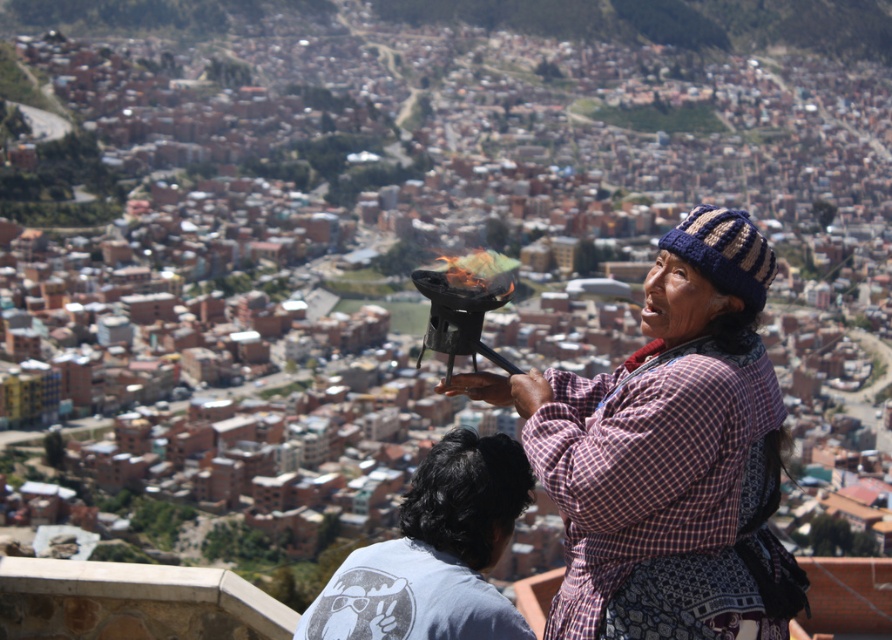
Question: Among these objects, which one is nearest to the camera?

Choices:
 (A) gray cotton shirt at lower left
 (B) light blue cotton t-shirt at lower center

Answer: (B)

Question: Where is plaid fabric shawl at center located in relation to light blue cotton t-shirt at lower center in the image?

Choices:
 (A) below
 (B) above

Answer: (B)

Question: Can you confirm if plaid fabric shawl at center is bigger than gray cotton shirt at lower left?

Choices:
 (A) yes
 (B) no

Answer: (A)

Question: Among these points, which one is nearest to the camera?

Choices:
 (A) [x=417, y=614]
 (B) [x=382, y=560]

Answer: (A)

Question: From the image, what is the correct spatial relationship of plaid fabric shawl at center in relation to light blue cotton t-shirt at lower center?

Choices:
 (A) below
 (B) above

Answer: (B)

Question: Based on their relative distances, which object is nearer to the light blue cotton t-shirt at lower center?

Choices:
 (A) plaid fabric shawl at center
 (B) gray cotton shirt at lower left

Answer: (B)